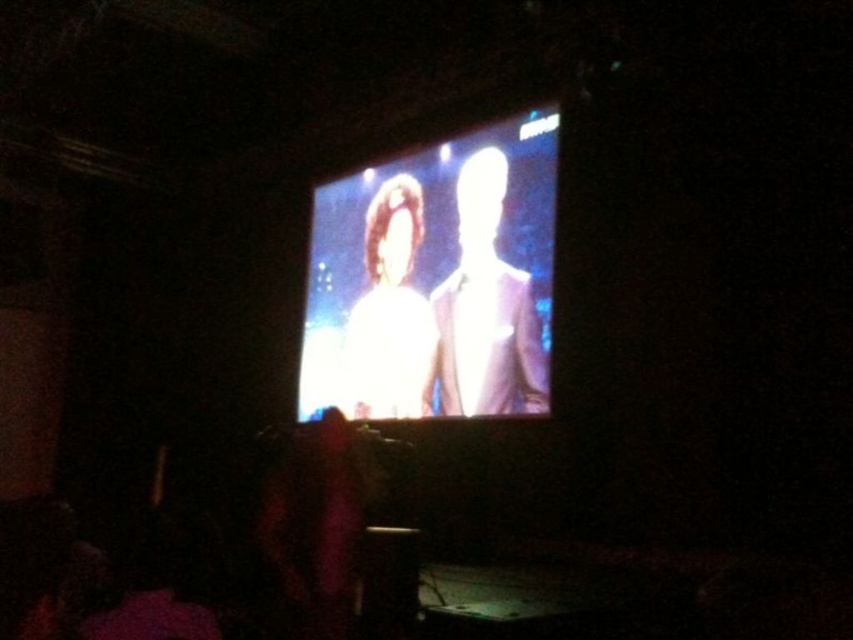
Question: Considering the real-world distances, which object is closest to the white glossy suit at center?

Choices:
 (A) white glossy shirt at center
 (B) bright glossy screen at center

Answer: (B)

Question: Can you confirm if white glossy suit at center is thinner than white glossy shirt at center?

Choices:
 (A) yes
 (B) no

Answer: (A)

Question: Which point is closer to the camera?

Choices:
 (A) (407, 344)
 (B) (421, 344)
 (C) (474, 337)

Answer: (C)

Question: Is white glossy suit at center to the right of white glossy shirt at center from the viewer's perspective?

Choices:
 (A) no
 (B) yes

Answer: (B)

Question: Can you confirm if bright glossy screen at center is wider than white glossy suit at center?

Choices:
 (A) yes
 (B) no

Answer: (A)

Question: Which of the following is the farthest from the observer?

Choices:
 (A) white glossy shirt at center
 (B) white glossy suit at center

Answer: (A)